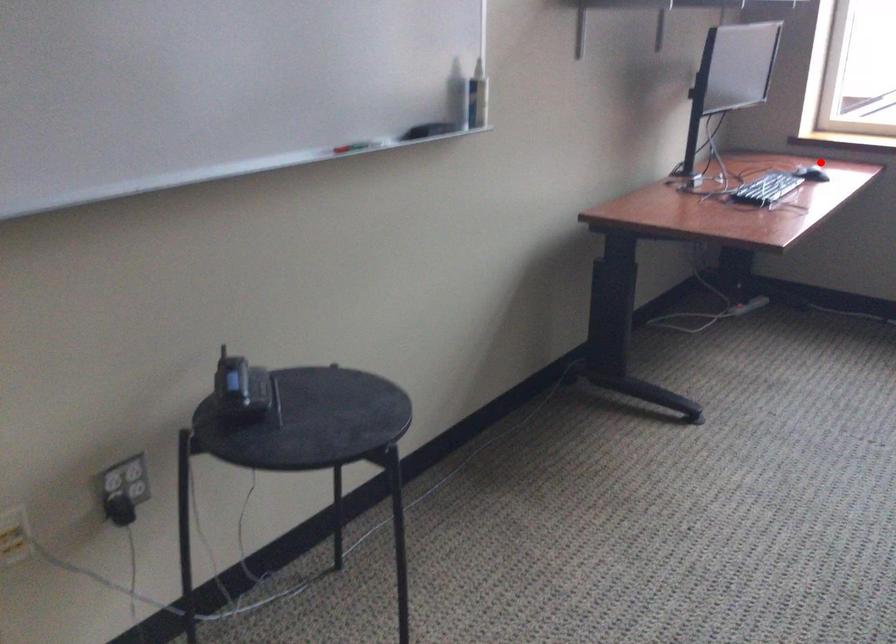
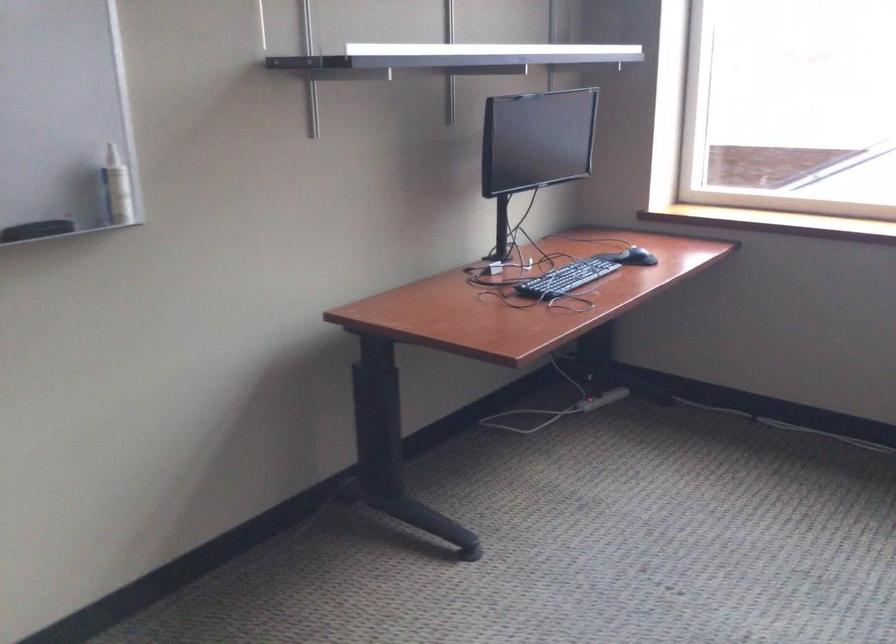
Question: I am providing you with two images of the same scene from different viewpoints. A red point is shown in image1. For the corresponding object point in image2, is it positioned nearer or farther from the camera?

Choices:
 (A) Nearer
 (B) Farther

Answer: (A)